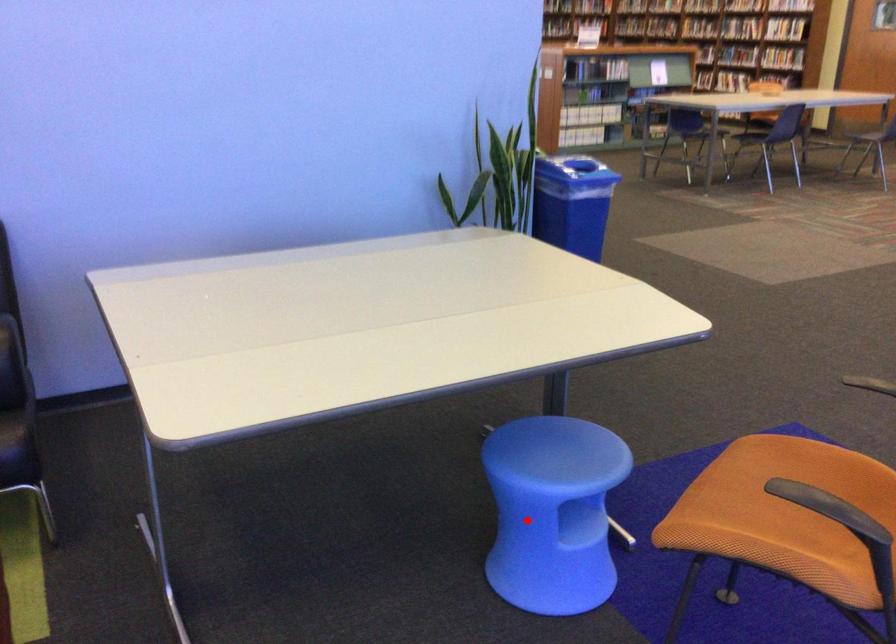
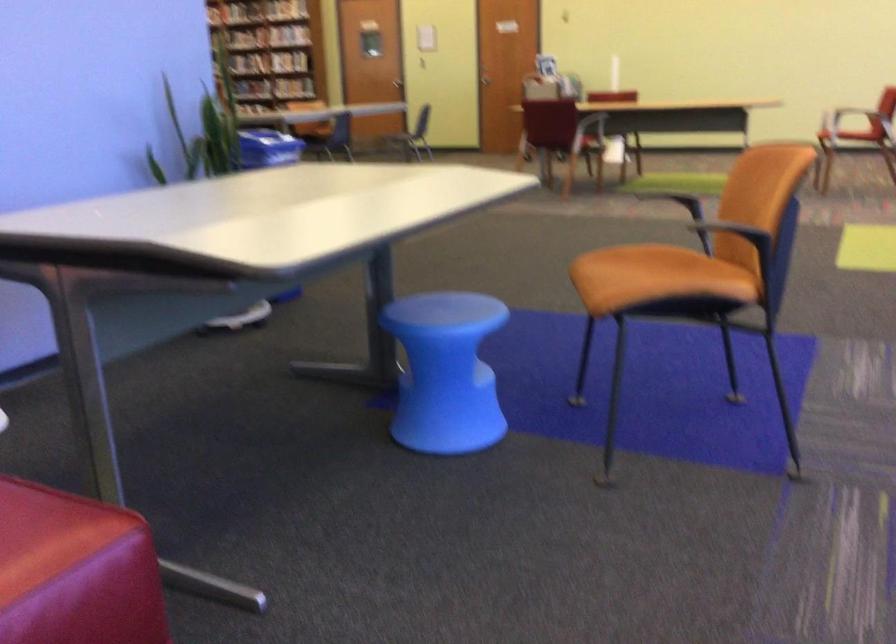
Question: I am providing you with two images of the same scene from different viewpoints. In image1, a red point is highlighted. Considering the same 3D point in image2, which of the following is correct?

Choices:
 (A) It is closer
 (B) It is farther

Answer: (B)